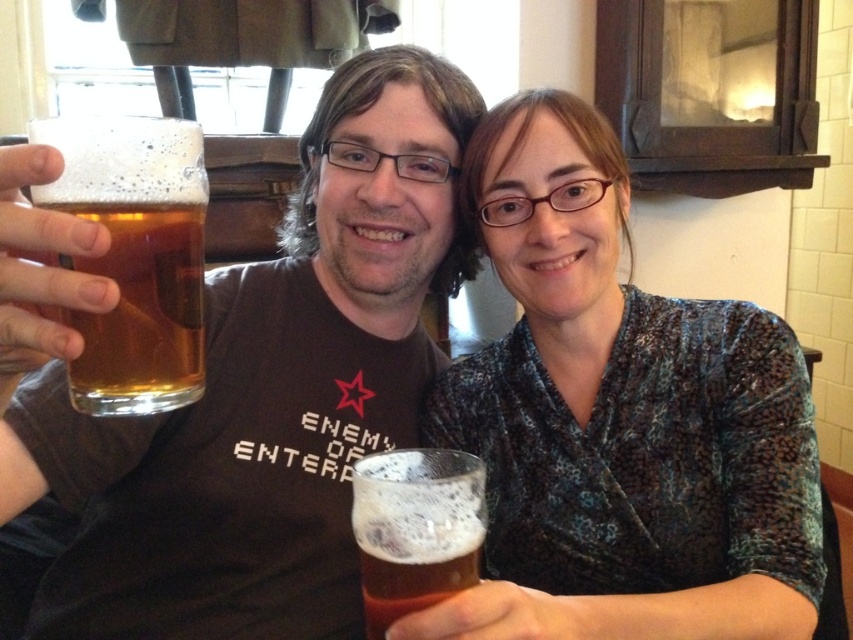
Does matte brown dress at center have a larger size compared to golden glass at left?

Yes, matte brown dress at center is bigger than golden glass at left.

Does matte brown dress at center have a lesser height compared to golden glass at left?

No, matte brown dress at center is not shorter than golden glass at left.

Is point (730, 540) more distant than point (184, 170)?

That is True.

The width and height of the screenshot is (853, 640). Find the location of `matte brown dress at center`. matte brown dress at center is located at coordinates (619, 420).

Is matte brown dress at center to the right of translucent glass at lower center from the viewer's perspective?

Indeed, matte brown dress at center is positioned on the right side of translucent glass at lower center.

Does point (585, 531) come in front of point (444, 496)?

No, it is behind (444, 496).

Between point (726, 612) and point (401, 490), which one is positioned behind?

The point (726, 612) is more distant.

Locate an element on the screen. This screenshot has width=853, height=640. matte brown dress at center is located at coordinates (619, 420).

Does translucent glass mug at upper left have a greater height compared to matte brown dress at center?

Indeed, translucent glass mug at upper left has a greater height compared to matte brown dress at center.

Which is in front, point (465, 141) or point (514, 484)?

Point (514, 484) is in front.

Locate an element on the screen. This screenshot has height=640, width=853. translucent glass mug at upper left is located at coordinates (267, 392).